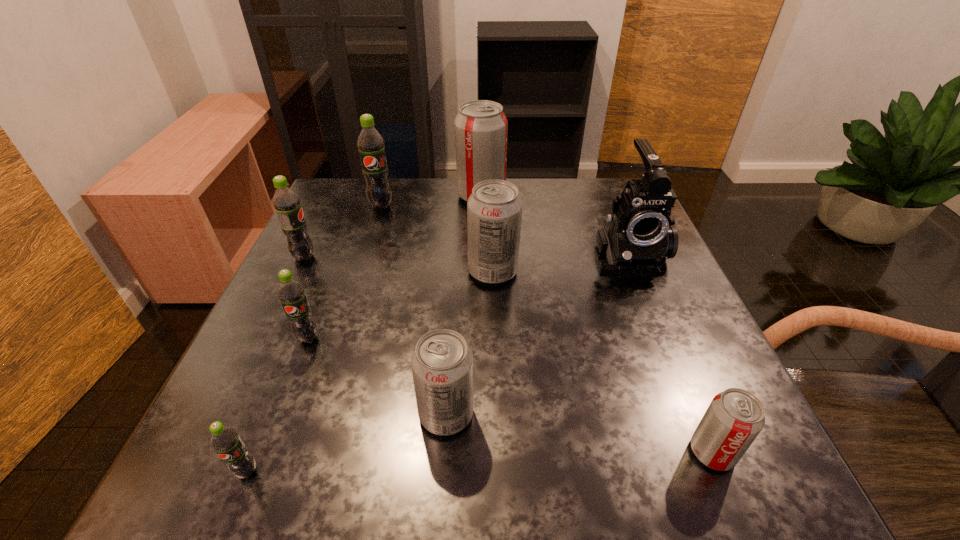
You are a GUI agent. You are given a task and a screenshot of the screen. Output one action in this format:
    pyautogui.click(x=<x>, y=<y>)
    Task: Click on the biggest gray soda can
    This screenshot has width=960, height=540.
    Given the screenshot: What is the action you would take?
    pyautogui.click(x=481, y=126)

Where is `the biggest green soda`? The width and height of the screenshot is (960, 540). the biggest green soda is located at coordinates (370, 143).

You are a GUI agent. You are given a task and a screenshot of the screen. Output one action in this format:
    pyautogui.click(x=<x>, y=<y>)
    Task: Click on the farthest green soda
    This screenshot has width=960, height=540.
    Given the screenshot: What is the action you would take?
    pyautogui.click(x=370, y=143)

The image size is (960, 540). I want to click on camcorder, so click(637, 240).

Where is `the leftmost soda can`? Image resolution: width=960 pixels, height=540 pixels. the leftmost soda can is located at coordinates (287, 204).

Where is `the leftmost green soda`? the leftmost green soda is located at coordinates (287, 204).

Where is `the second biggest gray soda can`? The height and width of the screenshot is (540, 960). the second biggest gray soda can is located at coordinates (494, 209).

I want to click on the third biggest gray soda can, so click(442, 363).

This screenshot has width=960, height=540. I want to click on the second nearest green soda, so click(x=291, y=293).

At what (x,y) coordinates should I click in order to perform the action: click on the fourth nearest object. Please return your answer as a coordinate pair (x, y). Looking at the image, I should click on (291, 293).